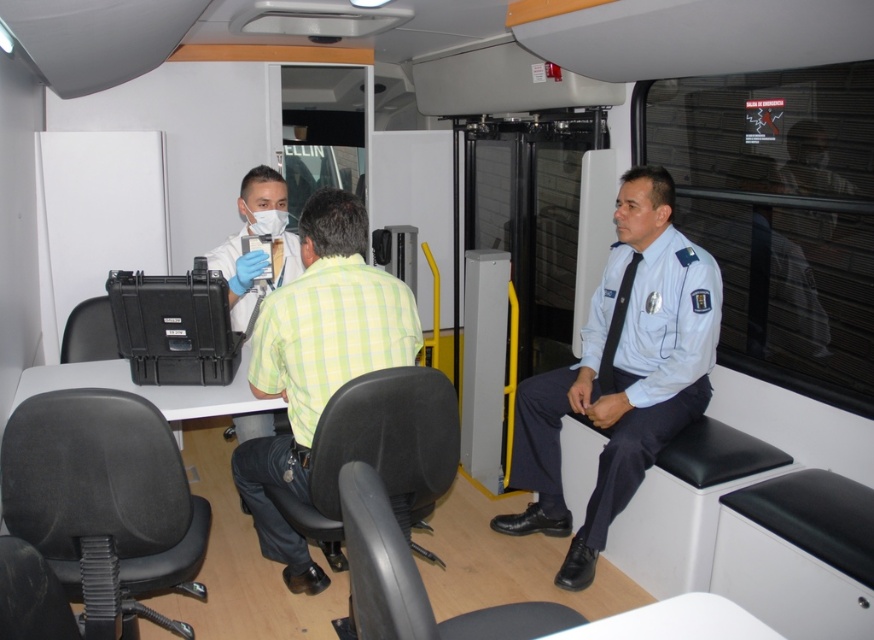
You are a passenger in the vehicle and need to hand a document to the person wearing the light blue uniform at right. Given your current position near the entrance door on the left side, can you reach them without moving out of your seat?

The light blue uniform at right is located at point (x=621, y=372), which suggests it is positioned towards the right side and lower part of the vehicle. Since you are seated near the entrance door on the left side, you would need to move to reach them, as they are seated on the opposite side.

You are a passenger in the vehicle and need to place a laptop on the white plastic table at center. However, the black plastic chair at lower left is blocking access to the table. Can you move the chair to reach the table?

The white plastic table at center is positioned under the black plastic chair at lower left, meaning the chair is directly above the table. Moving the chair would allow access to the table.

You are a delivery person who needs to place a 3.5 feet wide package between the light blue uniform at right and the black fabric chair at lower left. Can you fit it there?

The distance between the light blue uniform at right and the black fabric chair at lower left is 5.26 feet. Since the package is 3.5 feet wide, there is enough space to place it between them.